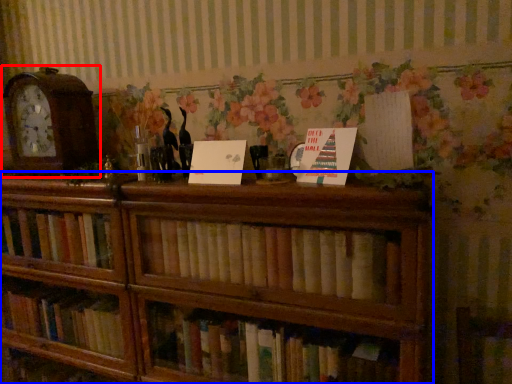
Question: Among these objects, which one is nearest to the camera, alarm clock (highlighted by a red box) or bookcase (highlighted by a blue box)?

Choices:
 (A) alarm clock
 (B) bookcase

Answer: (B)